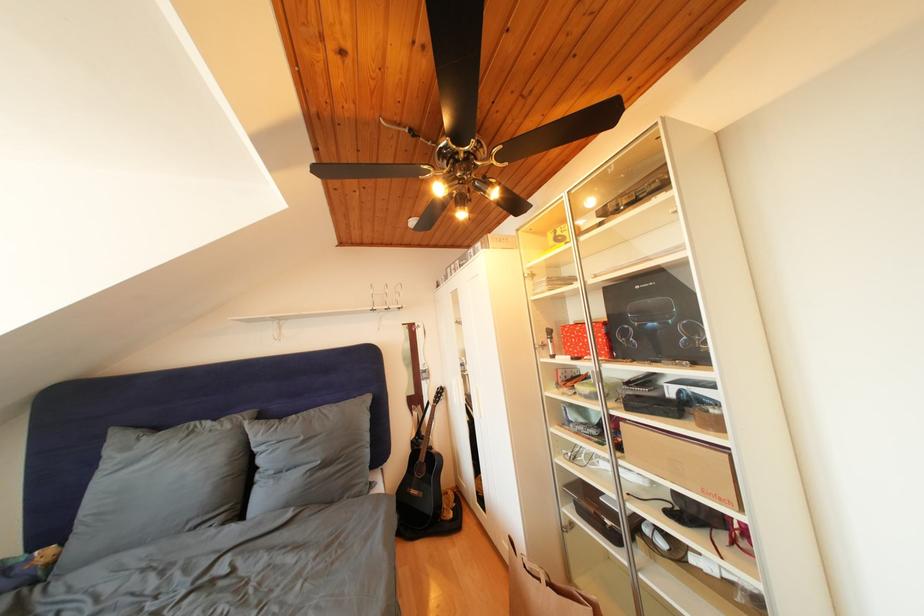
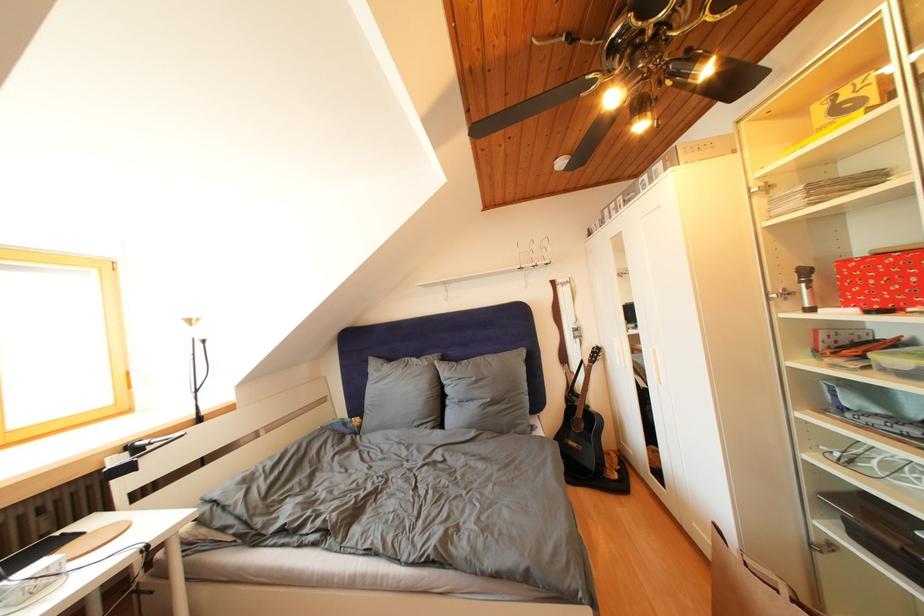
Question: The camera is either moving clockwise (left) or counter-clockwise (right) around the object. The first image is from the beginning of the video and the second image is from the end. Is the camera moving left or right when shooting the video?

Choices:
 (A) Left
 (B) Right

Answer: (B)